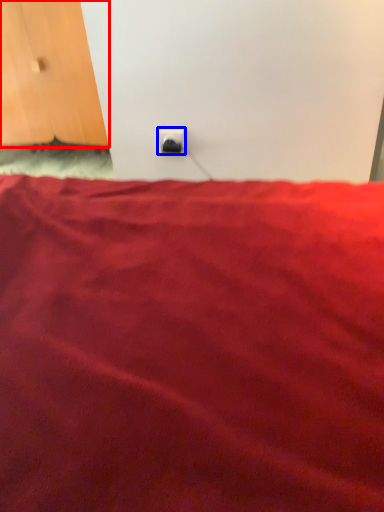
Question: Which object is closer to the camera taking this photo, door (highlighted by a red box) or power plugs and sockets (highlighted by a blue box)?

Choices:
 (A) door
 (B) power plugs and sockets

Answer: (B)